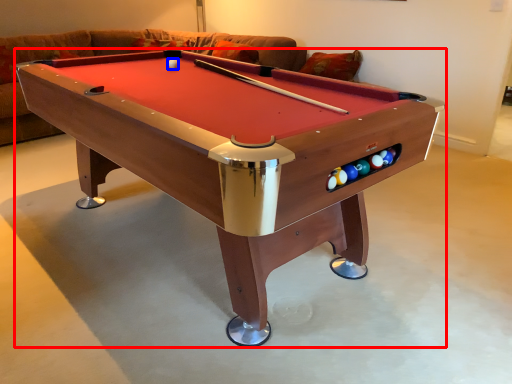
Question: Which point is closer to the camera, billiard table (highlighted by a red box) or ball (highlighted by a blue box)?

Choices:
 (A) billiard table
 (B) ball

Answer: (A)